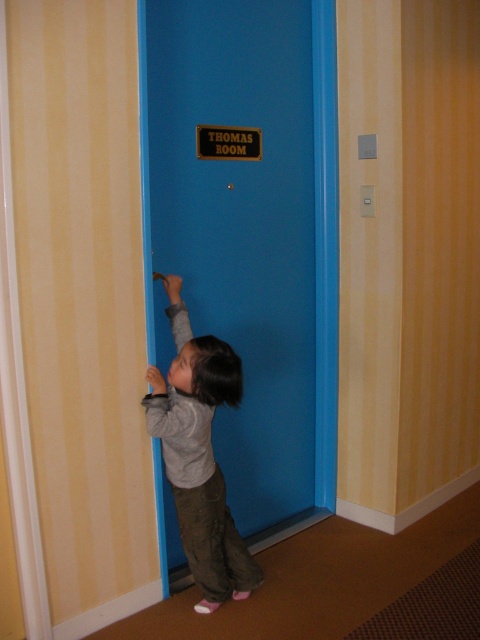
The child is trying to reach the door handle. There are two points marked in the image. The first point is at coordinates point (x=296, y=449) and the second point is at point (x=217, y=486). Which point is closer to the door handle?

Point (x=217, y=486) is closer to the door handle because it is in front of point (x=296, y=449).

You are a delivery person trying to hand a package to the child wearing the gray cotton shirt at center. Can you reach them without moving the blue matte door at center?

The blue matte door at center is closer to the viewer than the gray cotton shirt at center, so you can reach the gray cotton shirt at center by moving around the door or stepping forward since the door is in front but not blocking access.

You are a delivery person standing at the camera position. You need to deliver a package to the THOMAS ROOM. The package is too heavy to carry while reaching up. The point you need to reach is at coordinate point (250, 196). Can you reach that point without moving your position?

The distance between the point (250, 196) and the camera is 8.57 feet. Since the package is too heavy to carry while reaching up, you would not be able to reach the point (250, 196) without moving your position.